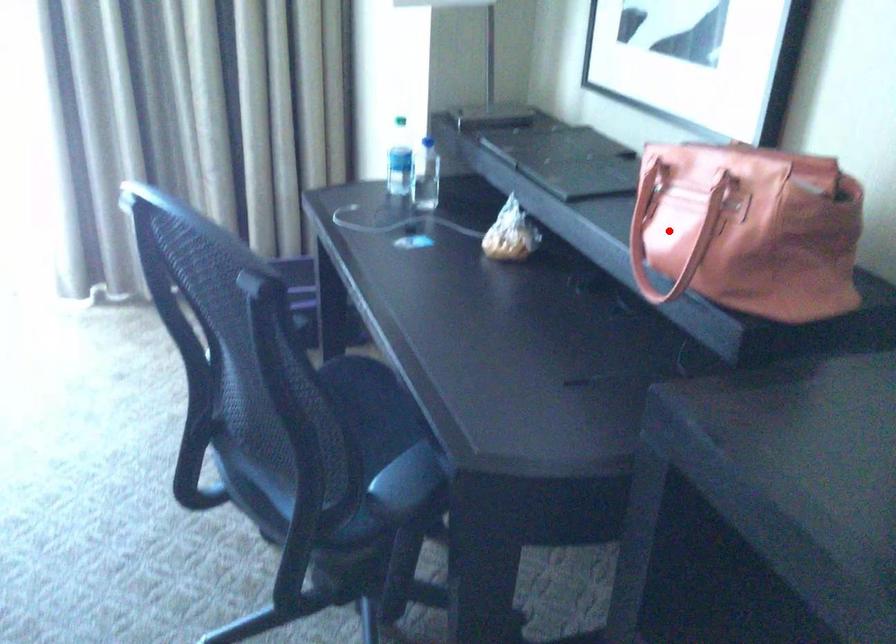
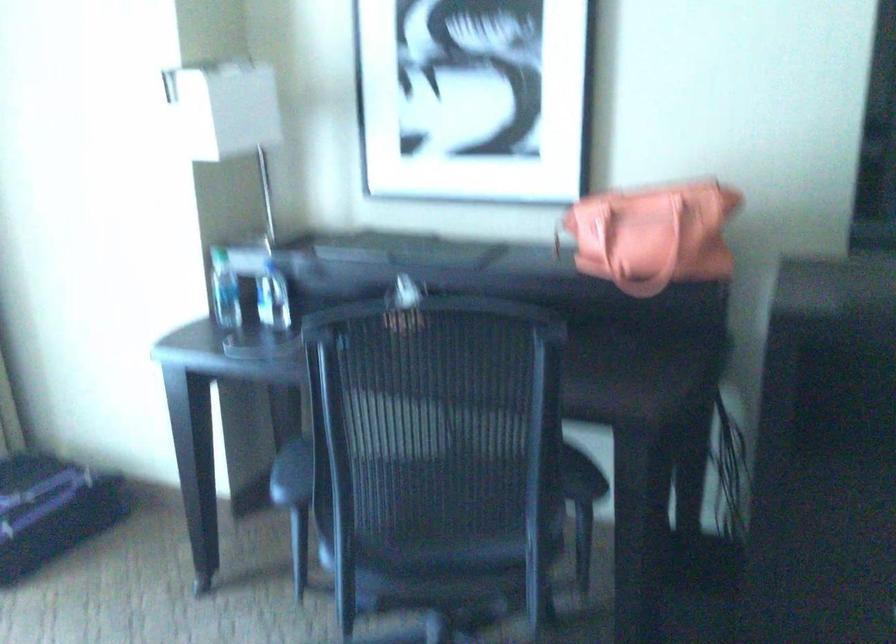
The point at the highlighted location is marked in the first image. Where is the corresponding point in the second image?

(633, 238)